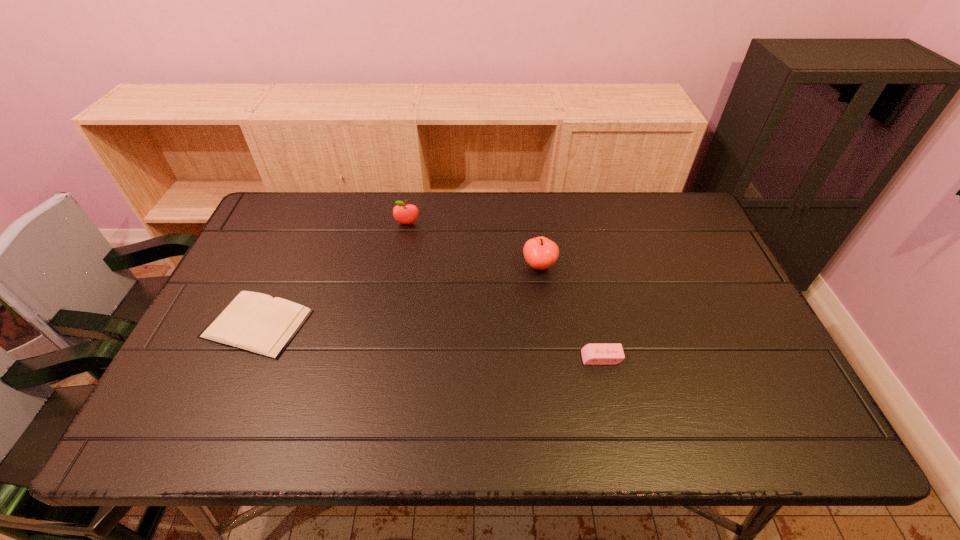
You are a GUI agent. You are given a task and a screenshot of the screen. Output one action in this format:
    pyautogui.click(x=<x>, y=<y>)
    Task: Click on the unoccupied position between the second object from right to left and the eraser
    This screenshot has height=540, width=960.
    Given the screenshot: What is the action you would take?
    pyautogui.click(x=570, y=312)

Identify the location of free spot between the rightmost object and the second object from left to right. This screenshot has width=960, height=540. (504, 291).

You are a GUI agent. You are given a task and a screenshot of the screen. Output one action in this format:
    pyautogui.click(x=<x>, y=<y>)
    Task: Click on the free area in between the left apple and the shortest object
    
    Given the screenshot: What is the action you would take?
    pyautogui.click(x=332, y=274)

Where is `vacant region between the nearer apple and the third tallest object`? vacant region between the nearer apple and the third tallest object is located at coordinates (570, 312).

Where is `unoccupied area between the second shortest object and the farther apple`? The width and height of the screenshot is (960, 540). unoccupied area between the second shortest object and the farther apple is located at coordinates (504, 291).

I want to click on blank region between the shortest object and the farthest object, so click(332, 274).

This screenshot has height=540, width=960. In order to click on vacant space that's between the nearer apple and the eraser in this screenshot , I will do `click(570, 312)`.

This screenshot has height=540, width=960. In order to click on vacant area that lies between the hardback book and the rightmost object in this screenshot , I will do 429,341.

Find the location of a particular element. The image size is (960, 540). empty space that is in between the right apple and the farthest object is located at coordinates (473, 245).

At what (x,y) coordinates should I click in order to perform the action: click on object that ranks as the third closest to the second object from left to right. Please return your answer as a coordinate pair (x, y). The image size is (960, 540). Looking at the image, I should click on (592, 354).